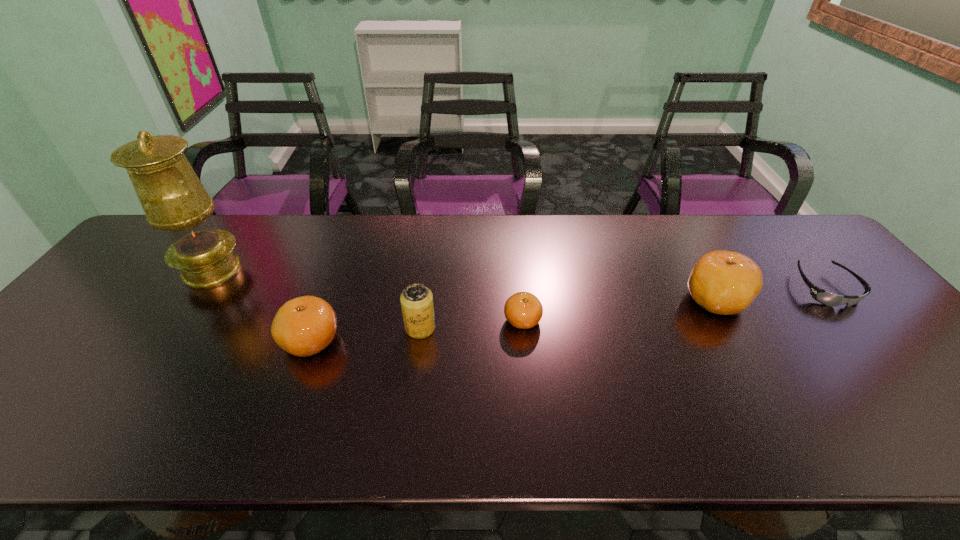
Find the location of a particular element. free space located 0.270m on the back of the leftmost clementine is located at coordinates (343, 254).

I want to click on vacant area located 0.110m on the back of the second clementine from right to left, so click(x=518, y=279).

At what (x,y) coordinates should I click in order to perform the action: click on blank space located on the left of the rightmost clementine. Please return your answer as a coordinate pair (x, y). Looking at the image, I should click on [x=568, y=301].

Find the location of `free region located on the lenses of the shortest object`. free region located on the lenses of the shortest object is located at coordinates (885, 360).

Locate an element on the screen. The height and width of the screenshot is (540, 960). vacant space located on the right of the third object from left to right is located at coordinates (518, 328).

You are a GUI agent. You are given a task and a screenshot of the screen. Output one action in this format:
    pyautogui.click(x=<x>, y=<y>)
    Task: Click on the free space located 0.090m on the left of the tallest object
    This screenshot has width=960, height=540.
    Given the screenshot: What is the action you would take?
    pyautogui.click(x=150, y=270)

Identify the location of object located in the far edge section of the desktop. The width and height of the screenshot is (960, 540). (174, 200).

Identify the location of object present at the right edge. This screenshot has width=960, height=540. (822, 296).

This screenshot has height=540, width=960. Find the location of `vacant space at the far edge of the desktop`. vacant space at the far edge of the desktop is located at coordinates (257, 217).

In the image, there is a desktop. Where is `vacant space at the near edge`? vacant space at the near edge is located at coordinates (124, 378).